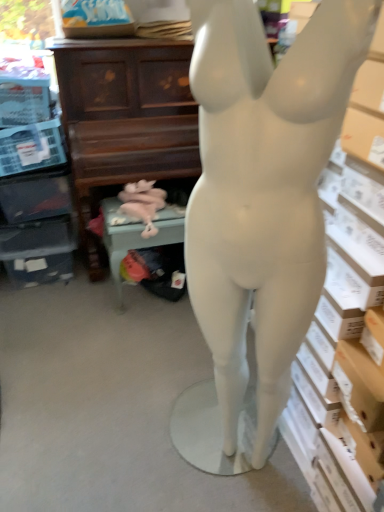
Find the location of a particular element. The width and height of the screenshot is (384, 512). vacant region below matte white mannequin at center (from a real-world perspective) is located at coordinates (228, 468).